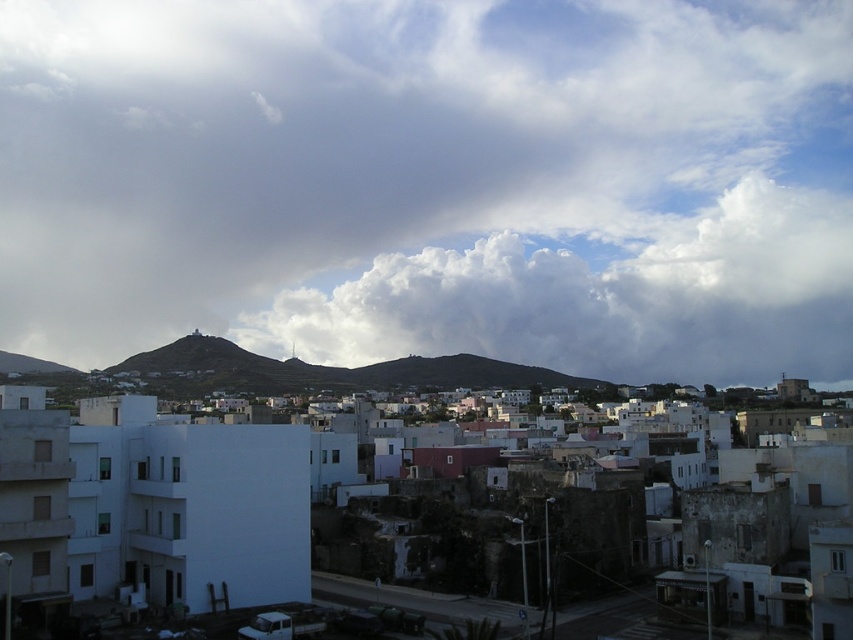
Between white fluffy cloud at upper center and white fluffy cloud at center, which one is positioned lower?

Positioned lower is white fluffy cloud at center.

Is white fluffy cloud at upper center bigger than white fluffy cloud at center?

Indeed, white fluffy cloud at upper center has a larger size compared to white fluffy cloud at center.

Is point (708, 67) farther from viewer compared to point (573, 353)?

Yes, point (708, 67) is farther from viewer.

At what (x,y) coordinates should I click in order to perform the action: click on white fluffy cloud at upper center. Please return your answer as a coordinate pair (x, y). Looking at the image, I should click on (432, 182).